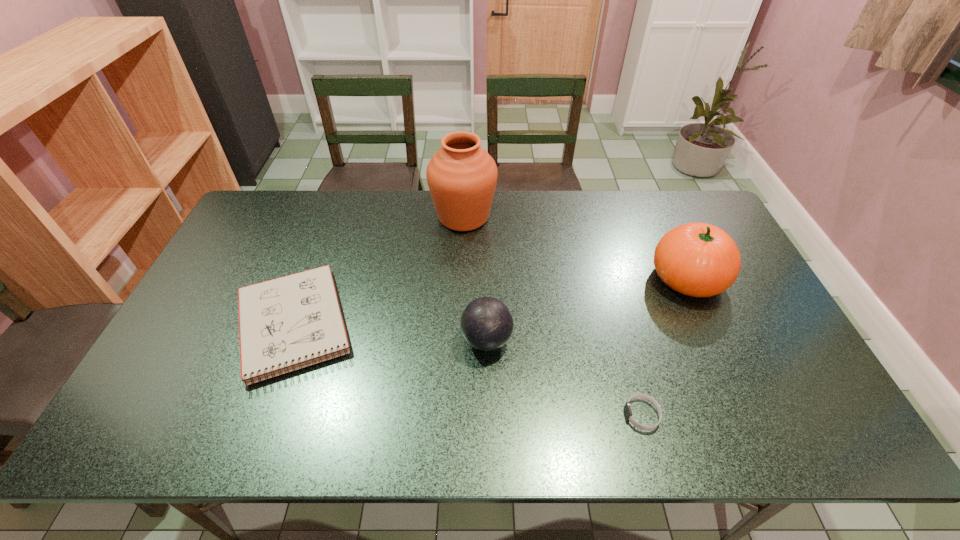
I want to click on the tallest object, so click(462, 176).

You are a GUI agent. You are given a task and a screenshot of the screen. Output one action in this format:
    pyautogui.click(x=<x>, y=<y>)
    Task: Click on the urn
    Image resolution: width=960 pixels, height=540 pixels.
    Given the screenshot: What is the action you would take?
    pyautogui.click(x=462, y=176)

Locate an element on the screen. The width and height of the screenshot is (960, 540). the rightmost object is located at coordinates (696, 259).

This screenshot has width=960, height=540. In order to click on the fourth shortest object in this screenshot , I will do `click(696, 259)`.

Locate an element on the screen. This screenshot has width=960, height=540. the third tallest object is located at coordinates (487, 323).

Where is `the second shortest object`? The height and width of the screenshot is (540, 960). the second shortest object is located at coordinates tap(294, 321).

Find the location of `notepad`. notepad is located at coordinates (294, 321).

Image resolution: width=960 pixels, height=540 pixels. What are the coordinates of `wristband` in the screenshot? It's located at (627, 409).

You are a GUI agent. You are given a task and a screenshot of the screen. Output one action in this format:
    pyautogui.click(x=<x>, y=<y>)
    Task: Click on the shortest object
    This screenshot has height=540, width=960.
    Given the screenshot: What is the action you would take?
    pyautogui.click(x=627, y=409)

This screenshot has height=540, width=960. I want to click on free region located 0.370m on the right of the urn, so click(x=603, y=217).